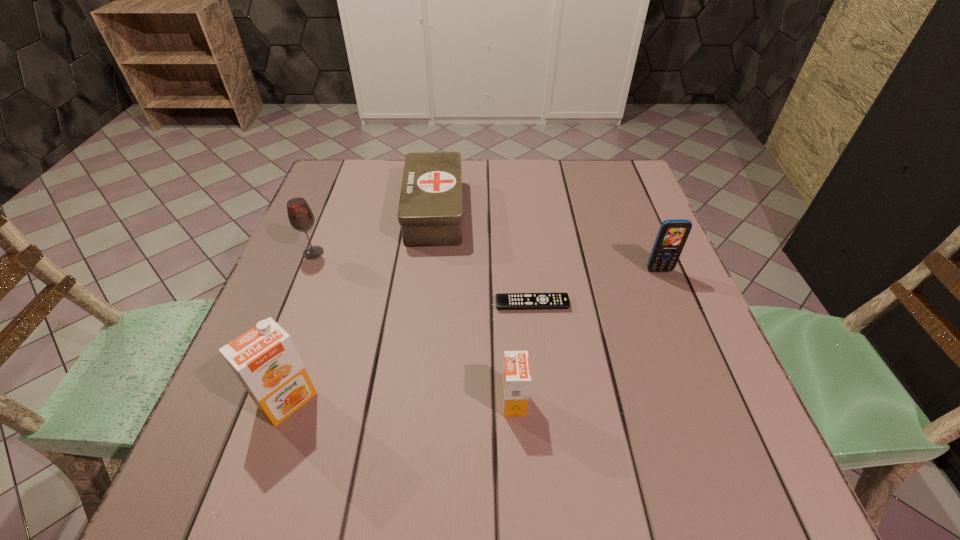
Where is `vacant point located between the glass drink container and the shorter orange juice`? This screenshot has width=960, height=540. vacant point located between the glass drink container and the shorter orange juice is located at coordinates (414, 327).

Find the location of a particular element. The height and width of the screenshot is (540, 960). free space that is in between the shortest object and the glass drink container is located at coordinates [422, 279].

Locate an element on the screen. This screenshot has height=540, width=960. free area in between the shorter orange juice and the glass drink container is located at coordinates (414, 327).

The image size is (960, 540). I want to click on vacant point located between the second shortest object and the right orange juice, so click(474, 307).

Image resolution: width=960 pixels, height=540 pixels. In order to click on vacant space that is in between the glass drink container and the first-aid kit in this screenshot , I will do `click(373, 232)`.

Identify the location of free space between the second shortest object and the rightmost object. (546, 241).

Locate an element on the screen. free space that is in between the remote control and the glass drink container is located at coordinates (422, 279).

What are the coordinates of `free space that is in between the glass drink container and the third farthest object` in the screenshot? It's located at (486, 262).

Image resolution: width=960 pixels, height=540 pixels. What are the coordinates of `object that is the second closest to the glass drink container` in the screenshot? It's located at (265, 360).

Identify which object is located as the third nearest to the fourth nearest object. Please provide its 2D coordinates. Your answer should be formatted as a tuple, i.e. [(x, y)], where the tuple contains the x and y coordinates of a point satisfying the conditions above.

[(430, 212)]